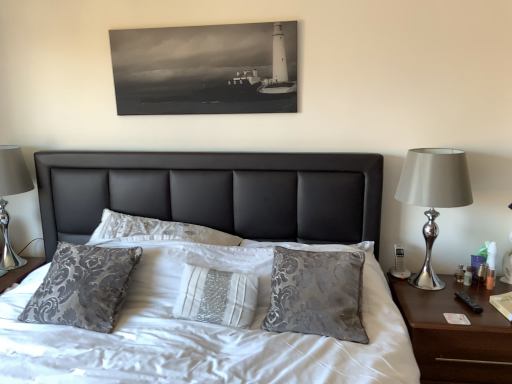
This screenshot has width=512, height=384. I want to click on free space above brown wood nightstand at right (from a real-world perspective), so click(455, 301).